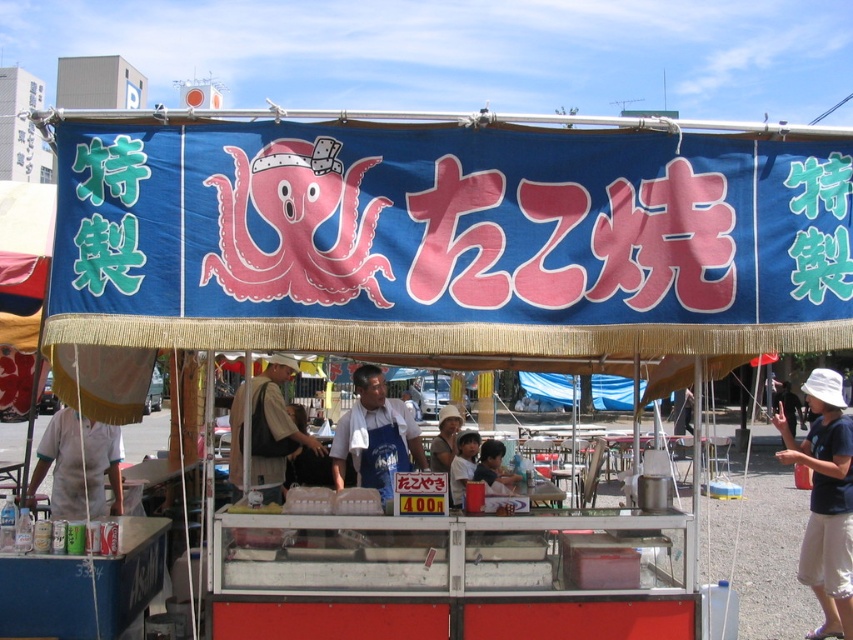
Does point (795, 339) come closer to viewer compared to point (282, 426)?

Yes, point (795, 339) is in front of point (282, 426).

Is blue fabric canopy at upper center to the left of khaki fabric apron at center from the viewer's perspective?

In fact, blue fabric canopy at upper center is to the right of khaki fabric apron at center.

The height and width of the screenshot is (640, 853). What do you see at coordinates (450, 236) in the screenshot?
I see `blue fabric canopy at upper center` at bounding box center [450, 236].

What are the coordinates of `blue fabric canopy at upper center` in the screenshot? It's located at (450, 236).

Can you confirm if blue fabric canopy at upper center is positioned to the right of blue apron at center?

Indeed, blue fabric canopy at upper center is positioned on the right side of blue apron at center.

Who is shorter, blue fabric canopy at upper center or blue apron at center?

blue apron at center

Which is in front, point (111, 220) or point (401, 435)?

Point (111, 220) is more forward.

Locate an element on the screen. Image resolution: width=853 pixels, height=640 pixels. blue fabric canopy at upper center is located at coordinates (450, 236).

Does white cotton hat at right appear on the right side of khaki fabric apron at center?

Indeed, white cotton hat at right is positioned on the right side of khaki fabric apron at center.

Between point (849, 557) and point (253, 394), which one is positioned in front?

Point (849, 557) is more forward.

Find the location of a particular element. This screenshot has width=853, height=640. white cotton hat at right is located at coordinates (825, 500).